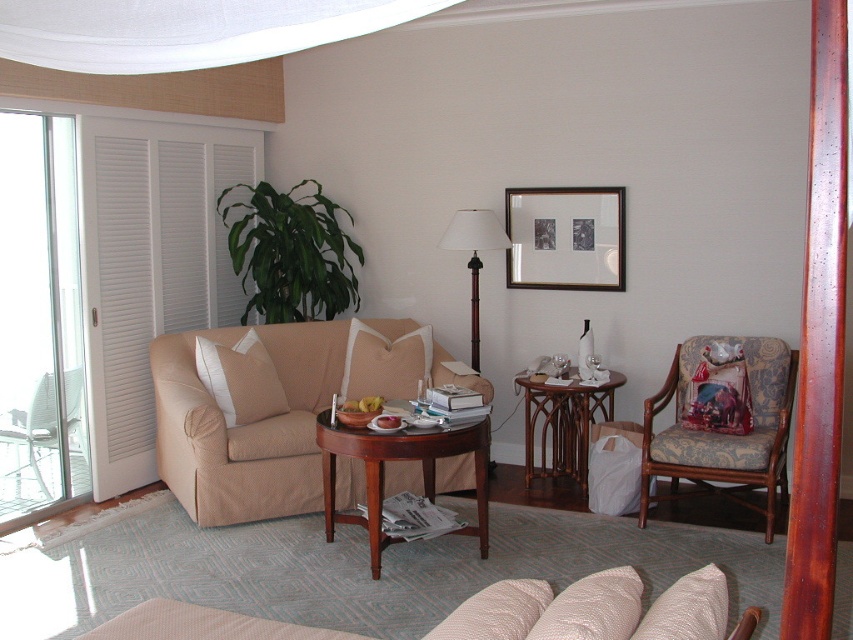
You are sitting on the beige fabric armchair at left and want to reach the wooden floor lamp at center to adjust its light. Which direction should you move to get closer to the lamp?

You should move to the right because the beige fabric armchair at left is to the left of the wooden floor lamp at center, so moving right will bring you closer to the lamp.

You are a guest entering the living room and want to sit down. Which object, the beige fabric couch at lower center or the woodenside table at right, is shorter and thus more suitable for sitting?

The beige fabric couch at lower center is not as tall as the woodenside table at right, so it is shorter and more suitable for sitting.